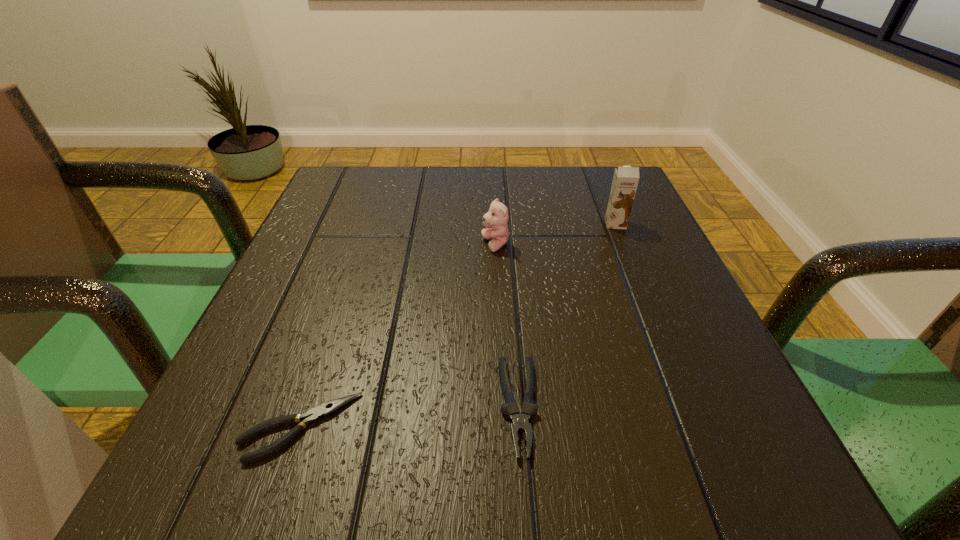
Find the location of a particular element. This screenshot has height=540, width=960. vacant space at the right edge of the desktop is located at coordinates (660, 354).

Identify the location of vacant area at the far left corner. The width and height of the screenshot is (960, 540). (383, 178).

Locate an element on the screen. The width and height of the screenshot is (960, 540). vacant space at the near left corner of the desktop is located at coordinates (295, 501).

At what (x,y) coordinates should I click in order to perform the action: click on vacant space at the far right corner of the desktop. Please return your answer as a coordinate pair (x, y). Looking at the image, I should click on (601, 177).

In the image, there is a desktop. Identify the location of vacant space at the near right corner. The height and width of the screenshot is (540, 960). [x=659, y=482].

Locate an element on the screen. This screenshot has width=960, height=540. unoccupied position between the third tallest object and the shorter pliers is located at coordinates (410, 417).

The width and height of the screenshot is (960, 540). What are the coordinates of `free spot between the teddy bear and the right pliers` in the screenshot? It's located at (507, 326).

Identify the location of free space that is in between the taller pliers and the second farthest object. The image size is (960, 540). (507, 326).

The image size is (960, 540). Find the location of `free point between the second farthest object and the second shortest object`. free point between the second farthest object and the second shortest object is located at coordinates (x=507, y=326).

The width and height of the screenshot is (960, 540). Find the location of `free spot between the third shortest object and the rightmost object`. free spot between the third shortest object and the rightmost object is located at coordinates (556, 234).